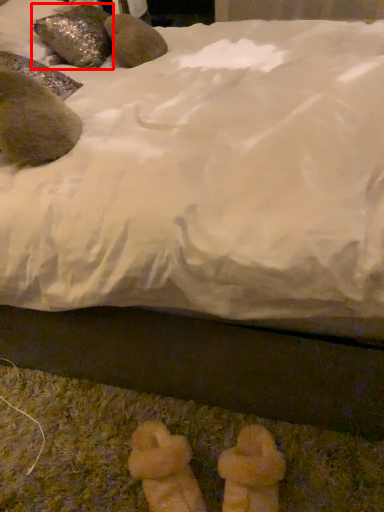
Question: From the image's perspective, considering the relative positions of animal (annotated by the red box) and animal in the image provided, where is animal (annotated by the red box) located with respect to the staircase?

Choices:
 (A) below
 (B) above

Answer: (B)